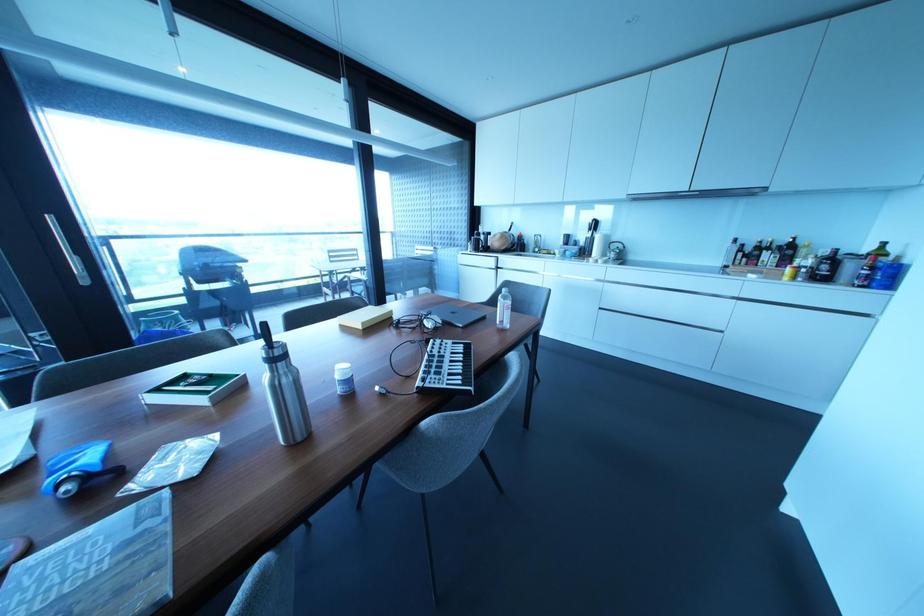
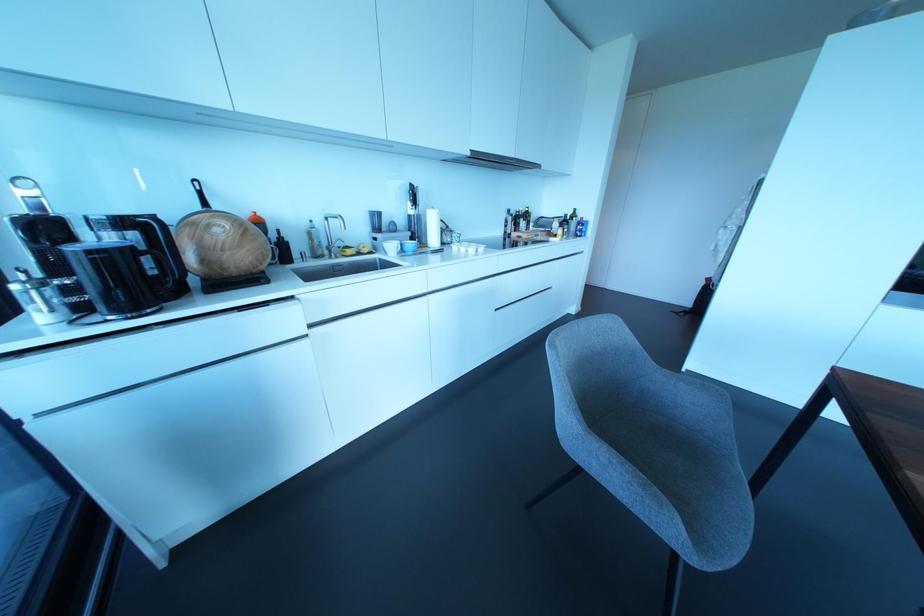
In the second image, find the point that corresponds to [588,235] in the first image.

(410, 211)